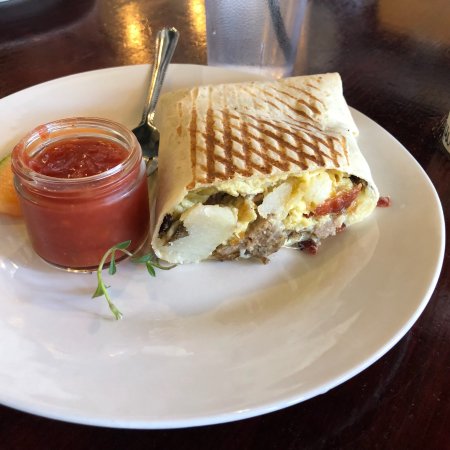
Where is `glass container`? glass container is located at coordinates (94, 234).